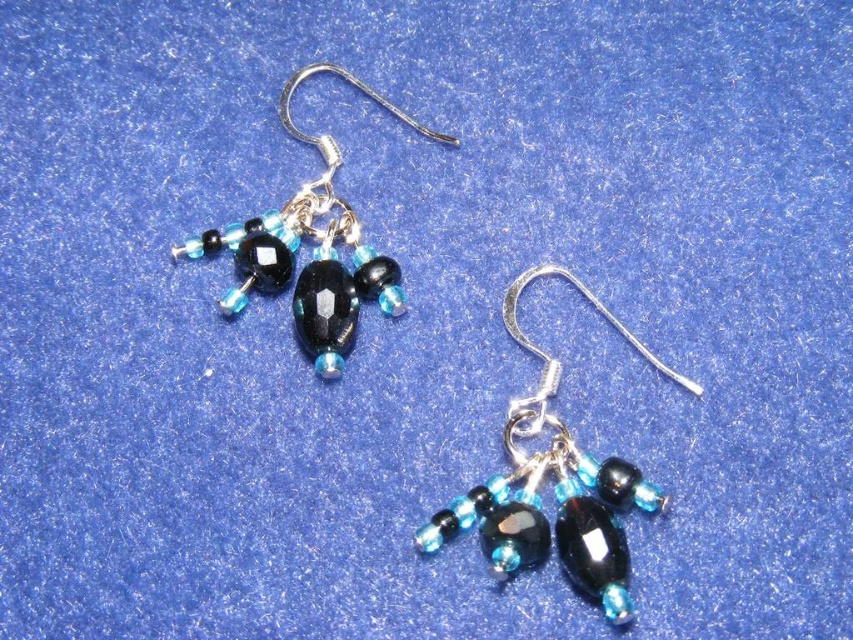
Looking at this image, looking at the earrings displayed against the blue background, where is the matte black glass bead at center in relation to the matte black bead at upper left?

The matte black glass bead at center is located to the right of the matte black bead at upper left.

Based on the photo, you are an appraiser evaluating the placement of beads in the earrings. The point marked at coordinates (554, 484) is part of which bead in the earrings?

The point marked at coordinates (554, 484) is on the matte black glass bead at center.

You are an appraiser evaluating the symmetry of the earrings. The symmetry score is determined by how close the central bead is to the center of the image. The center of the image is at point 0.5,0.5. What is the symmetry score of the matte black glass bead at center?

The symmetry score is determined by the distance from the center of the image. The matte black glass bead at center is located at point (554, 484), which is farther from the center point (426, 320) than required for perfect symmetry. Therefore, the symmetry score would be lower due to its position.